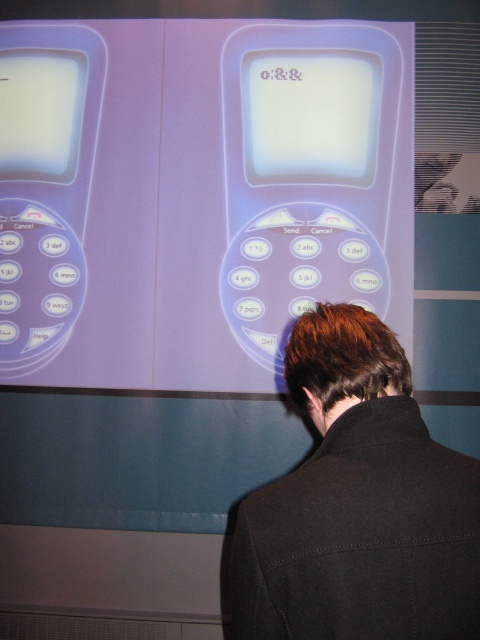
Question: Which point is farther to the camera?

Choices:
 (A) matte white button at center
 (B) black fabric at center
 (C) white glossy screen at center

Answer: (C)

Question: Which point is farther to the camera?

Choices:
 (A) matte plastic button at center
 (B) matte white button at center
 (C) white glossy screen at upper left

Answer: (C)

Question: Does white glossy screen at center appear on the right side of matte white button at center?

Choices:
 (A) yes
 (B) no

Answer: (A)

Question: Is white glossy screen at center thinner than matte plastic button at center?

Choices:
 (A) no
 (B) yes

Answer: (A)

Question: Among these points, which one is farthest from the camera?

Choices:
 (A) (240, 269)
 (B) (21, 92)
 (C) (241, 300)

Answer: (B)

Question: Considering the relative positions of black fabric at center and white glossy screen at center in the image provided, where is black fabric at center located with respect to white glossy screen at center?

Choices:
 (A) below
 (B) above

Answer: (A)